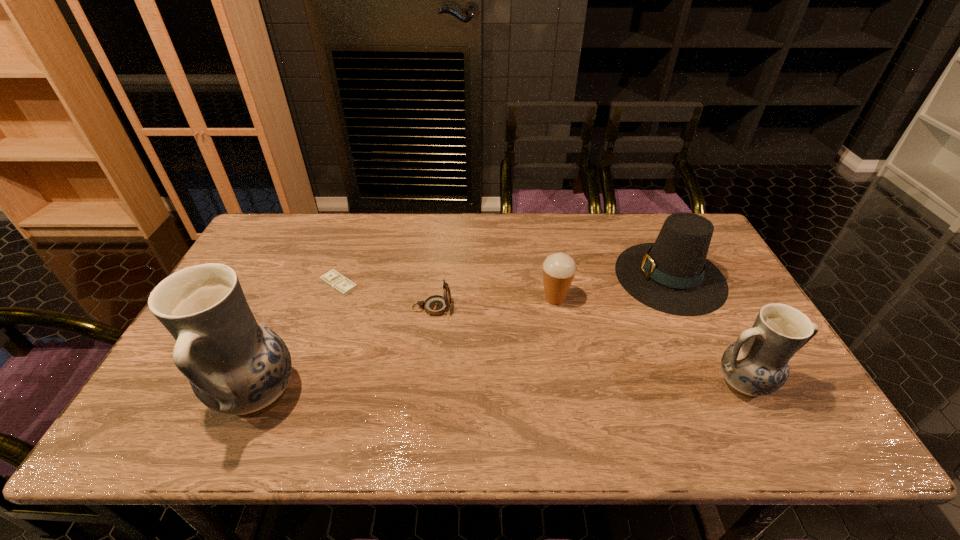
I want to click on free spot located on the back of the right pottery, so click(718, 334).

Find the location of `free location located 0.280m on the back of the third shortest object`. free location located 0.280m on the back of the third shortest object is located at coordinates tap(542, 232).

In order to click on free region located on the front-facing side of the hat in this screenshot , I will do coord(486,276).

Find the location of a particular element. vacant region located on the front-facing side of the hat is located at coordinates (588, 276).

In order to click on free space located 0.060m on the front-facing side of the hat in this screenshot , I will do `click(597, 276)`.

I want to click on vacant space located 0.140m on the front of the shortest object, so click(323, 334).

The width and height of the screenshot is (960, 540). What are the coordinates of `free spot located on the face of the second shortest object` in the screenshot? It's located at (579, 308).

Locate an element on the screen. object located at the far edge is located at coordinates (672, 275).

This screenshot has height=540, width=960. I want to click on object present at the left edge, so click(x=236, y=366).

What are the coordinates of `pottery located at the right edge` in the screenshot? It's located at (757, 364).